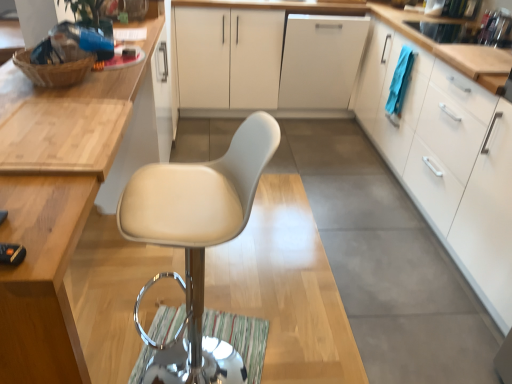
Describe the element at coordinates (397, 31) in the screenshot. I see `white glossy countertop at center` at that location.

I want to click on white glossy countertop at center, so 397,31.

This screenshot has height=384, width=512. What do you see at coordinates (55, 205) in the screenshot? I see `matte wood cabinet at upper left, positioned as the 3th cabinetry in right-to-left order` at bounding box center [55, 205].

Describe the element at coordinates (447, 159) in the screenshot. I see `white matte cabinet at right, which is the third cabinetry in left-to-right order` at that location.

What is the approximate width of white matte cabinet at center?

It is 29.45 inches.

At what (x,y) coordinates should I click in order to perform the action: click on white glossy countertop at center. Please return your answer as a coordinate pair (x, y). Looking at the image, I should click on (397, 31).

Is white leather chair at center taller than matte wood cabinet at upper left, the first cabinetry from the left?

Yes.

Considering the relative sizes of white leather chair at center and matte wood cabinet at upper left, the first cabinetry from the left, in the image provided, is white leather chair at center wider than matte wood cabinet at upper left, the first cabinetry from the left,?

No.

Considering the relative positions of white leather chair at center and matte wood cabinet at upper left, positioned as the 3th cabinetry in right-to-left order, in the image provided, is white leather chair at center to the left or to the right of matte wood cabinet at upper left, positioned as the 3th cabinetry in right-to-left order,?

Based on their positions, white leather chair at center is located to the right of matte wood cabinet at upper left, positioned as the 3th cabinetry in right-to-left order.

Which is correct: white leather chair at center is inside matte wood cabinet at upper left, positioned as the 3th cabinetry in right-to-left order, or outside of it?

white leather chair at center is outside matte wood cabinet at upper left, positioned as the 3th cabinetry in right-to-left order.

Between white matte cabinet at right, acting as the 1th cabinetry starting from the right, and white matte cabinet at center, acting as the second cabinetry starting from the right, which one has larger width?

white matte cabinet at center, acting as the second cabinetry starting from the right, is wider.

What's the angular difference between white matte cabinet at right, which is the third cabinetry in left-to-right order, and white matte cabinet at center, acting as the second cabinetry starting from the right,'s facing directions?

The angle between the facing direction of white matte cabinet at right, which is the third cabinetry in left-to-right order, and the facing direction of white matte cabinet at center, acting as the second cabinetry starting from the right, is 91.2 degrees.

Considering the relative positions of white matte cabinet at right, which is the third cabinetry in left-to-right order, and white matte cabinet at center, acting as the second cabinetry starting from the right, in the image provided, is white matte cabinet at right, which is the third cabinetry in left-to-right order, to the left of white matte cabinet at center, acting as the second cabinetry starting from the right, from the viewer's perspective?

In fact, white matte cabinet at right, which is the third cabinetry in left-to-right order, is to the right of white matte cabinet at center, acting as the second cabinetry starting from the right.

Which point is more distant from viewer, (481,282) or (332,33)?

Positioned behind is point (332,33).

Is white matte cabinet at center at the left side of white glossy countertop at center?

Incorrect, white matte cabinet at center is not on the left side of white glossy countertop at center.

Measure the distance between white matte cabinet at center and white glossy countertop at center.

The distance of white matte cabinet at center from white glossy countertop at center is 16.83 inches.

Image resolution: width=512 pixels, height=384 pixels. Identify the location of countertop lying below the white matte cabinet at center (from the image's perspective). (397, 31).

Does white matte cabinet at center turn towards white glossy countertop at center?

Yes.

Considering the sizes of objects white leather chair at center and white matte cabinet at center in the image provided, who is shorter, white leather chair at center or white matte cabinet at center?

white matte cabinet at center.

Does white leather chair at center come in front of white matte cabinet at center?

Yes, it is.

Identify the location of chair that is on the left side of white matte cabinet at center. (197, 240).

Considering the positions of objects white leather chair at center and white matte cabinet at center in the image provided, who is more to the left, white leather chair at center or white matte cabinet at center?

From the viewer's perspective, white leather chair at center appears more on the left side.

Does point (193, 47) lie in front of point (182, 365)?

No, (193, 47) is further to viewer.

Looking at this image, considering the relative sizes of white matte cabinet at center, acting as the second cabinetry starting from the right, and white leather chair at center in the image provided, is white matte cabinet at center, acting as the second cabinetry starting from the right, wider than white leather chair at center?

Yes, white matte cabinet at center, acting as the second cabinetry starting from the right, is wider than white leather chair at center.

Can you confirm if white matte cabinet at center, acting as the second cabinetry starting from the right, is positioned to the right of white leather chair at center?

Indeed, white matte cabinet at center, acting as the second cabinetry starting from the right, is positioned on the right side of white leather chair at center.

From a real-world perspective, between white matte cabinet at center, positioned as the 2th cabinetry in left-to-right order, and white leather chair at center, who is vertically lower?

white matte cabinet at center, positioned as the 2th cabinetry in left-to-right order, is physically lower.

Is matte wood cabinet at upper left, positioned as the 3th cabinetry in right-to-left order, in front of or behind white glossy countertop at center in the image?

Visually, matte wood cabinet at upper left, positioned as the 3th cabinetry in right-to-left order, is located in front of white glossy countertop at center.

Which is more to the left, matte wood cabinet at upper left, the first cabinetry from the left, or white glossy countertop at center?

From the viewer's perspective, matte wood cabinet at upper left, the first cabinetry from the left, appears more on the left side.

Based on the photo, would you say matte wood cabinet at upper left, the first cabinetry from the left, contains white glossy countertop at center?

No, white glossy countertop at center is not inside matte wood cabinet at upper left, the first cabinetry from the left.

Can you confirm if matte wood cabinet at upper left, the first cabinetry from the left, is taller than white glossy countertop at center?

Yes.

From the picture: Could you measure the distance between white matte cabinet at center and matte wood cabinet at upper left, positioned as the 3th cabinetry in right-to-left order?

The distance of white matte cabinet at center from matte wood cabinet at upper left, positioned as the 3th cabinetry in right-to-left order, is 6.85 feet.

This screenshot has height=384, width=512. There is a white matte cabinet at center. What are the coordinates of `the 3rd cabinetry above it (from a real-world perspective)` in the screenshot? It's located at (55, 205).

Is white matte cabinet at center in front of or behind matte wood cabinet at upper left, positioned as the 3th cabinetry in right-to-left order, in the image?

white matte cabinet at center is behind matte wood cabinet at upper left, positioned as the 3th cabinetry in right-to-left order.

There is a white leather chair at center. Where is `the 1st cabinetry below it (from a real-world perspective)`? This screenshot has width=512, height=384. the 1st cabinetry below it (from a real-world perspective) is located at coordinates (55, 205).

At what (x,y) coordinates should I click in order to perform the action: click on cabinetry above the white matte cabinet at right, acting as the 1th cabinetry starting from the right (from the image's perspective). Please return your answer as a coordinate pair (x, y). Looking at the image, I should click on (236, 59).

Estimate the real-world distances between objects in this image. Which object is closer to white matte cabinet at center, positioned as the 2th cabinetry in left-to-right order, matte wood cabinet at upper left, the first cabinetry from the left, or white glossy countertop at center?

white glossy countertop at center is positioned closer to the anchor white matte cabinet at center, positioned as the 2th cabinetry in left-to-right order.

Looking at the image, which one is located further to white matte cabinet at center, acting as the second cabinetry starting from the right, white matte cabinet at right, acting as the 1th cabinetry starting from the right, or white matte cabinet at center?

white matte cabinet at right, acting as the 1th cabinetry starting from the right.

Considering their positions, is white matte cabinet at center, positioned as the 2th cabinetry in left-to-right order, positioned further to white matte cabinet at right, which is the third cabinetry in left-to-right order, than matte wood cabinet at upper left, the first cabinetry from the left?

matte wood cabinet at upper left, the first cabinetry from the left, is positioned further to the anchor white matte cabinet at right, which is the third cabinetry in left-to-right order.

In the scene shown: Based on their spatial positions, is white matte cabinet at center or white matte cabinet at right, acting as the 1th cabinetry starting from the right, further from matte wood cabinet at upper left, positioned as the 3th cabinetry in right-to-left order?

white matte cabinet at center lies further to matte wood cabinet at upper left, positioned as the 3th cabinetry in right-to-left order, than the other object.

Based on their spatial positions, is white glossy countertop at center or white leather chair at center closer to white matte cabinet at center?

white glossy countertop at center lies closer to white matte cabinet at center than the other object.

Looking at the image, which one is located closer to white matte cabinet at center, positioned as the 2th cabinetry in left-to-right order, matte wood cabinet at upper left, positioned as the 3th cabinetry in right-to-left order, or white leather chair at center?

Among the two, matte wood cabinet at upper left, positioned as the 3th cabinetry in right-to-left order, is located nearer to white matte cabinet at center, positioned as the 2th cabinetry in left-to-right order.

Looking at the image, which one is located further to white glossy countertop at center, white matte cabinet at center, positioned as the 2th cabinetry in left-to-right order, or white matte cabinet at center?

The object further to white glossy countertop at center is white matte cabinet at center.

Considering their positions, is white matte cabinet at center positioned further to white matte cabinet at right, which is the third cabinetry in left-to-right order, than matte wood cabinet at upper left, positioned as the 3th cabinetry in right-to-left order?

matte wood cabinet at upper left, positioned as the 3th cabinetry in right-to-left order, lies further to white matte cabinet at right, which is the third cabinetry in left-to-right order, than the other object.

Identify the location of countertop situated between white leather chair at center and white matte cabinet at right, acting as the 1th cabinetry starting from the right, from left to right. Image resolution: width=512 pixels, height=384 pixels. (397, 31).

Where is `countertop between matte wood cabinet at upper left, the first cabinetry from the left, and white matte cabinet at center, along the z-axis`? The width and height of the screenshot is (512, 384). countertop between matte wood cabinet at upper left, the first cabinetry from the left, and white matte cabinet at center, along the z-axis is located at coordinates (397, 31).

Image resolution: width=512 pixels, height=384 pixels. I want to click on chair between matte wood cabinet at upper left, positioned as the 3th cabinetry in right-to-left order, and white matte cabinet at center, along the z-axis, so click(x=197, y=240).

I want to click on countertop positioned between white leather chair at center and white matte cabinet at center, positioned as the 2th cabinetry in left-to-right order, from near to far, so click(x=397, y=31).